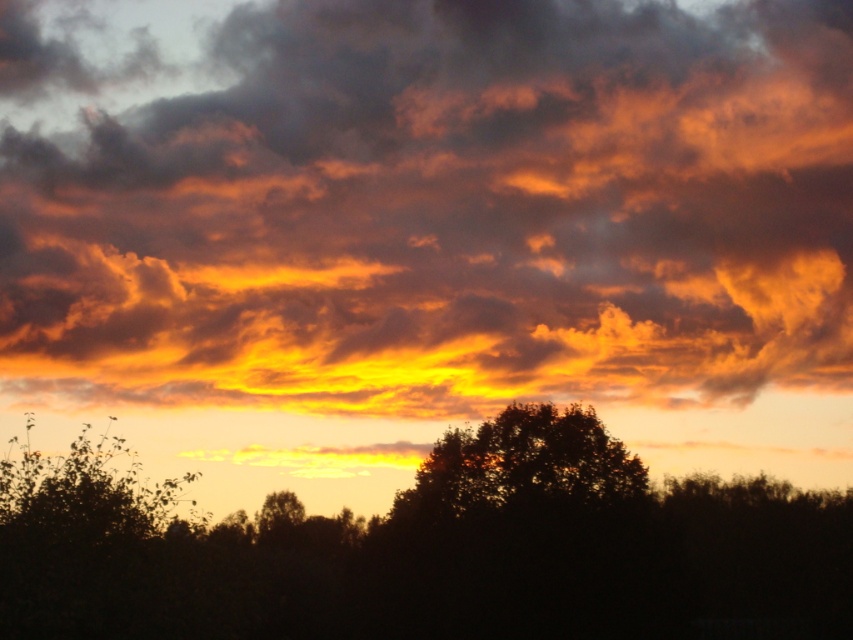
Does orange cotton clouds at upper center have a greater height compared to silhouette tree at center?

Yes.

Is orange cotton clouds at upper center bigger than silhouette tree at center?

Correct, orange cotton clouds at upper center is larger in size than silhouette tree at center.

This screenshot has width=853, height=640. I want to click on orange cotton clouds at upper center, so coord(447,212).